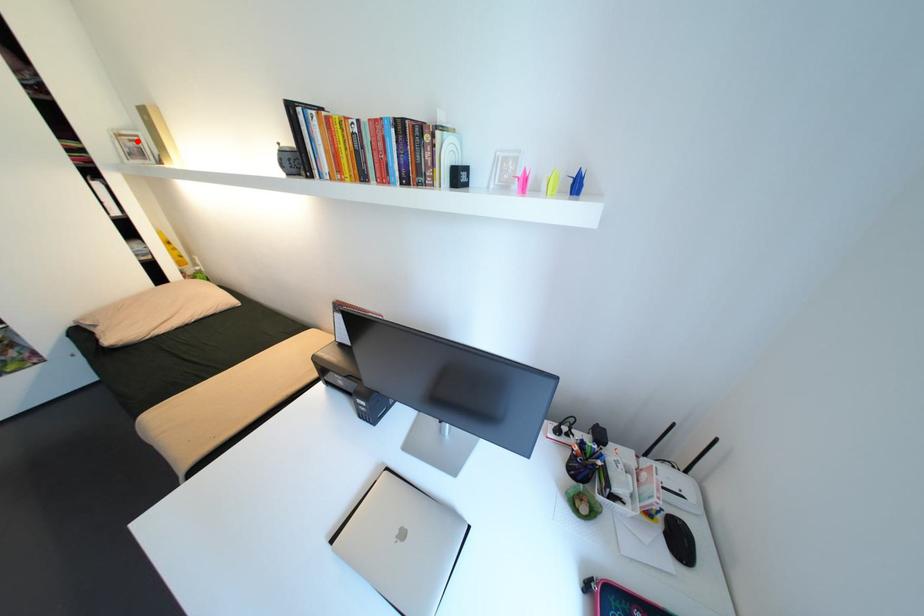
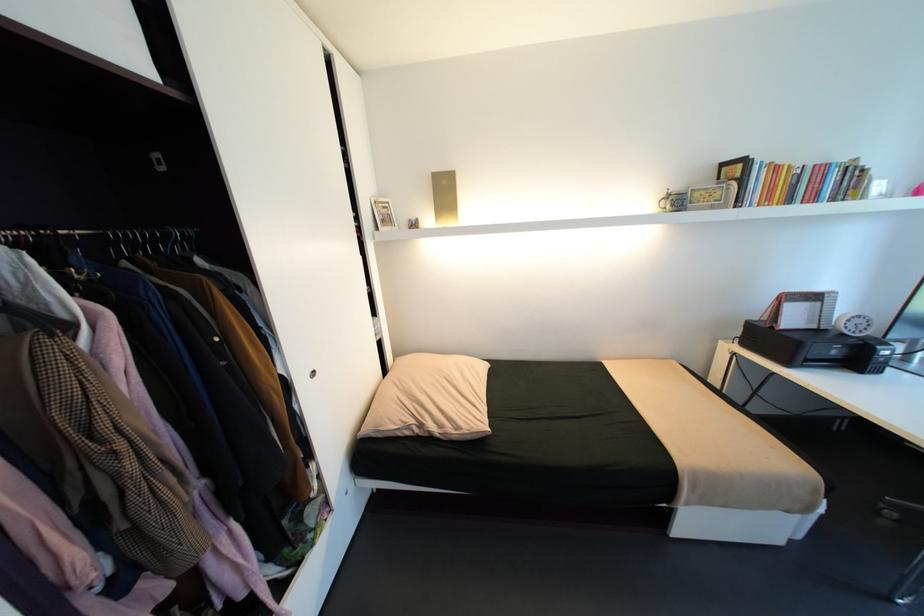
Question: I am providing you with two images of the same scene from different viewpoints. Given a red point in image1, look at the same physical point in image2. Is it:

Choices:
 (A) Closer to the viewpoint
 (B) Farther from the viewpoint

Answer: (A)